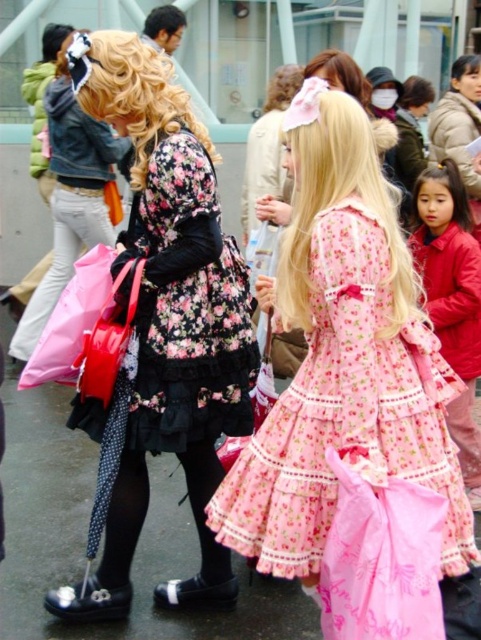
In the scene shown: You are a photographer standing in the street scene. You want to take a photo focusing on the pink satin dress at center and the matte pink fabric bag at lower left. Which object should you adjust your camera focus to first to ensure both are in the frame?

The pink satin dress at center is closer to the viewer than the matte pink fabric bag at lower left, so you should focus on the pink satin dress at center first to ensure both are in the frame.